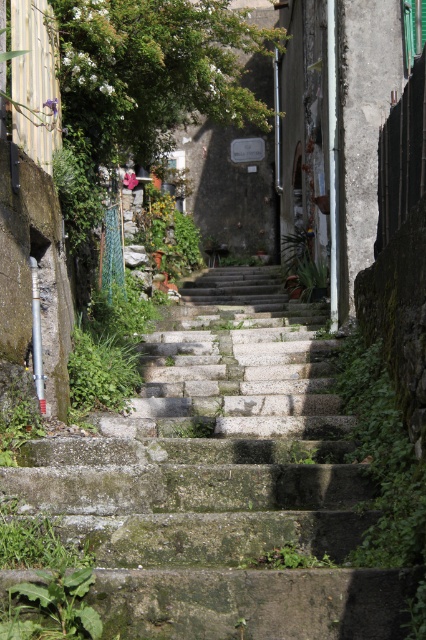
Measure the distance from green mossy stone stairs at center to green leafy weed at lower left.

green mossy stone stairs at center and green leafy weed at lower left are 30.03 inches apart from each other.

Between green mossy stone stairs at center and green leafy weed at lower left, which one has more height?

With more height is green mossy stone stairs at center.

I want to click on green mossy stone stairs at center, so click(221, 481).

Identify the location of green mossy stone stairs at center. Image resolution: width=426 pixels, height=640 pixels. (221, 481).